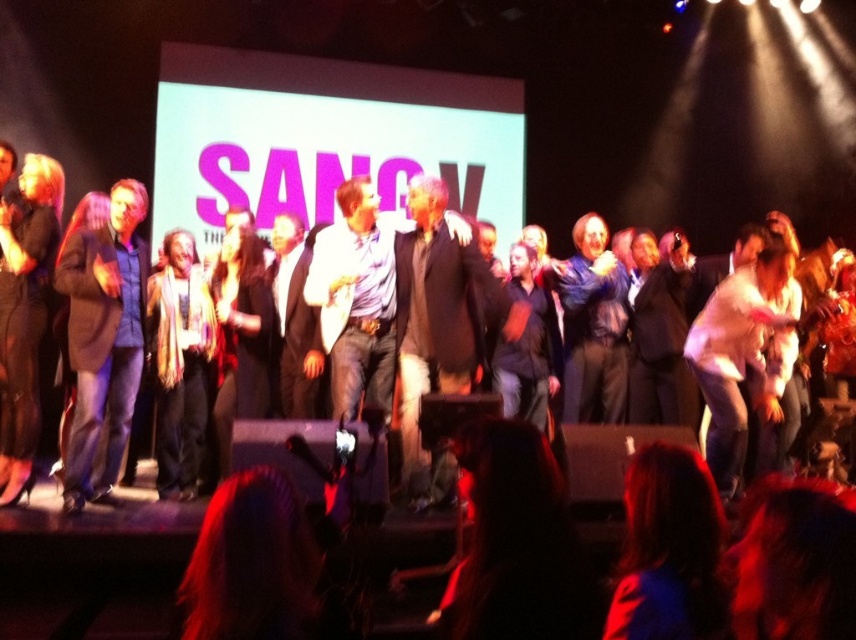
Question: Does dark brown hair at lower center have a larger size compared to dark blue jeans at center?

Choices:
 (A) yes
 (B) no

Answer: (B)

Question: Which of the following is the closest to the observer?

Choices:
 (A) (528, 284)
 (B) (100, 234)

Answer: (B)

Question: Is black suit at center to the left of dark blue jeans at center from the viewer's perspective?

Choices:
 (A) no
 (B) yes

Answer: (B)

Question: Which of the following is the farthest from the observer?

Choices:
 (A) dark blue jeans at center
 (B) dark hair at lower center
 (C) brown leather jacket at left
 (D) black suit at center

Answer: (A)

Question: Is fuzzy scarf at center below black suit at center?

Choices:
 (A) yes
 (B) no

Answer: (A)

Question: Which point is closer to the camera?

Choices:
 (A) (544, 634)
 (B) (143, 195)
 (C) (620, 608)
 (D) (526, 333)

Answer: (A)